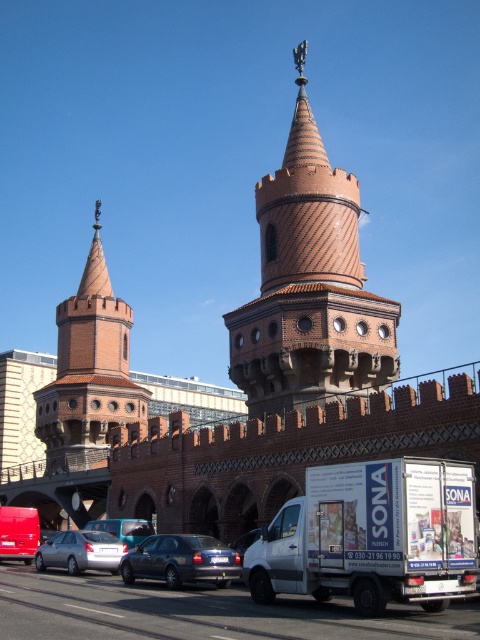
Question: Can you confirm if brown textured tower at center is wider than metallic silver sedan at center?

Choices:
 (A) no
 (B) yes

Answer: (B)

Question: Based on their relative distances, which object is farther from the metallic silver van at center?

Choices:
 (A) brown textured tower at center
 (B) white matte van at lower right
 (C) matte red van at lower left

Answer: (B)

Question: Can you confirm if white matte van at lower right is positioned above satin silver car at lower left?

Choices:
 (A) no
 (B) yes

Answer: (B)

Question: Is white matte van at lower right bigger than matte red van at lower left?

Choices:
 (A) no
 (B) yes

Answer: (A)

Question: Based on their relative distances, which object is farther from the metallic gray sedan at center?

Choices:
 (A) matte red van at lower left
 (B) brick stonework tower at left

Answer: (B)

Question: Which object is farther from the camera taking this photo?

Choices:
 (A) matte red van at lower left
 (B) brown textured tower at center

Answer: (B)